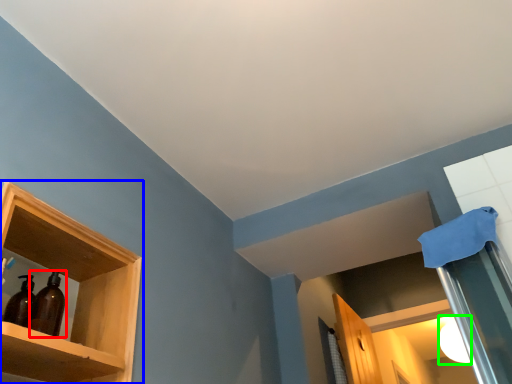
Question: Which object is positioned farthest from bottle (highlighted by a red box)? Select from shelf (highlighted by a blue box) and lighting (highlighted by a green box).

Choices:
 (A) shelf
 (B) lighting

Answer: (B)